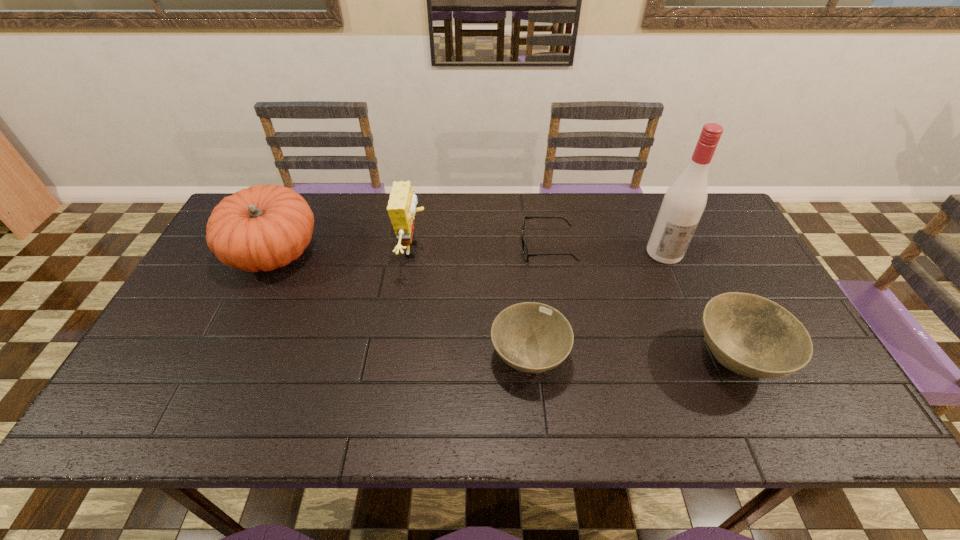
This screenshot has width=960, height=540. In order to click on the shorter bowl in this screenshot , I will do `click(531, 337)`.

At what (x,y) coordinates should I click in order to perform the action: click on the left bowl. Please return your answer as a coordinate pair (x, y). Looking at the image, I should click on (531, 337).

Identify the location of the fourth tallest object. The width and height of the screenshot is (960, 540). (x=750, y=335).

Locate an element on the screen. The image size is (960, 540). the right bowl is located at coordinates tap(750, 335).

This screenshot has height=540, width=960. Find the location of `the leftmost object`. the leftmost object is located at coordinates (x=264, y=227).

I want to click on the fifth object from right to left, so click(x=401, y=208).

This screenshot has width=960, height=540. What are the coordinates of `the tallest object` in the screenshot? It's located at (684, 202).

Where is `spectacles`? This screenshot has width=960, height=540. spectacles is located at coordinates (526, 254).

Identify the location of vacant area situated 0.150m on the back of the second shortest object. This screenshot has height=540, width=960. (522, 285).

This screenshot has height=540, width=960. What are the coordinates of `vacant point located 0.280m on the back of the taller bowl` in the screenshot? It's located at (684, 250).